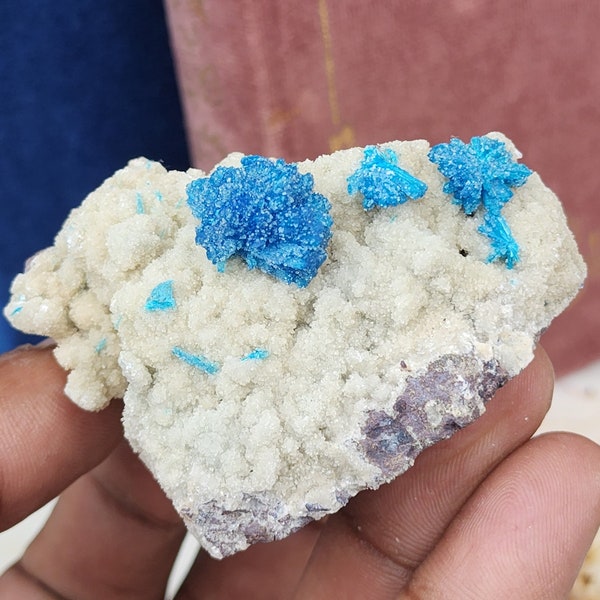
This screenshot has width=600, height=600. In order to click on gold lining decoration in this screenshot , I will do `click(206, 88)`, `click(330, 66)`.